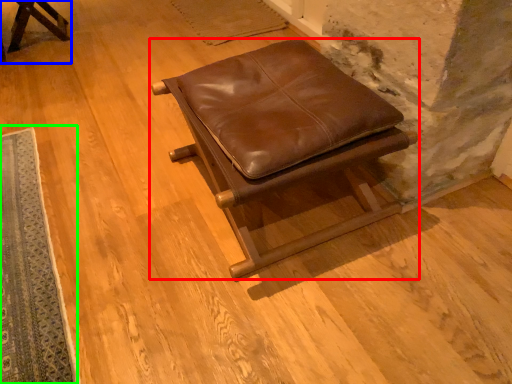
Question: Estimate the real-world distances between objects in this image. Which object is closer to furniture (highlighted by a red box), furniture (highlighted by a blue box) or mat (highlighted by a green box)?

Choices:
 (A) furniture
 (B) mat

Answer: (B)